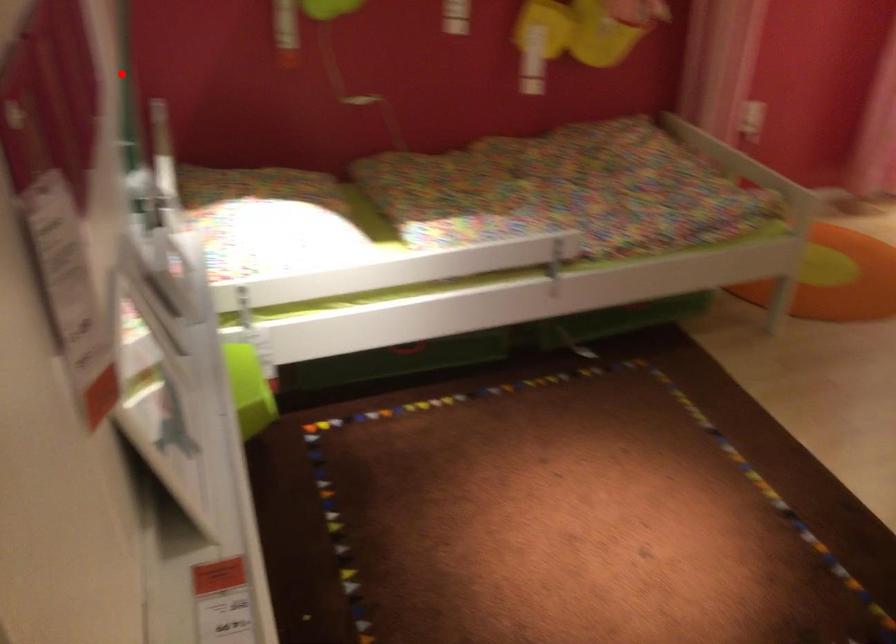
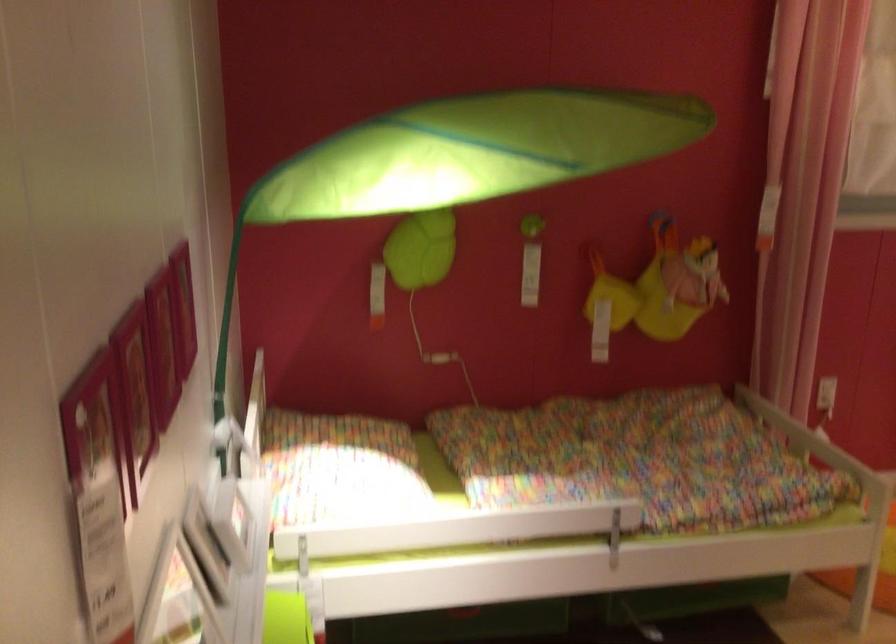
Question: I am providing you with two images of the same scene from different viewpoints. In image1, a red point is highlighted. Considering the same 3D point in image2, which of the following is correct?

Choices:
 (A) It is closer
 (B) It is farther

Answer: (B)